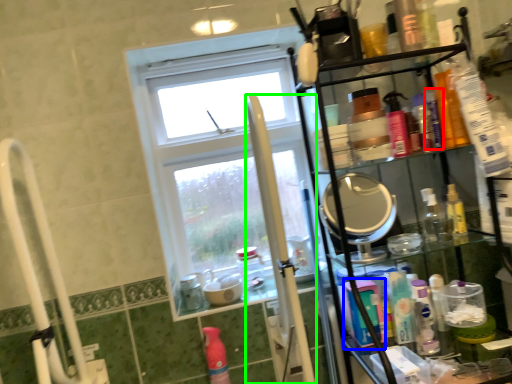
Question: Estimate the real-world distances between objects in this image. Which object is closer to toiletry (highlighted by a red box), mouthwash (highlighted by a blue box) or pole (highlighted by a green box)?

Choices:
 (A) mouthwash
 (B) pole

Answer: (A)